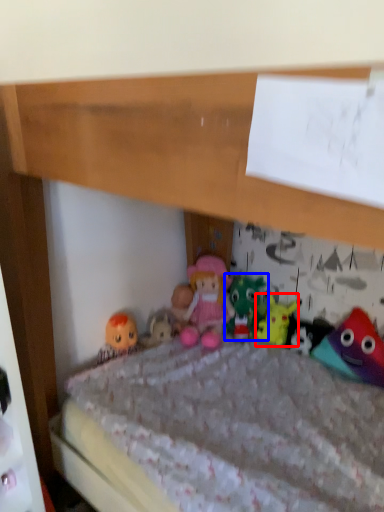
Question: Which object is further to the camera taking this photo, toy (highlighted by a red box) or toy (highlighted by a blue box)?

Choices:
 (A) toy
 (B) toy

Answer: (B)